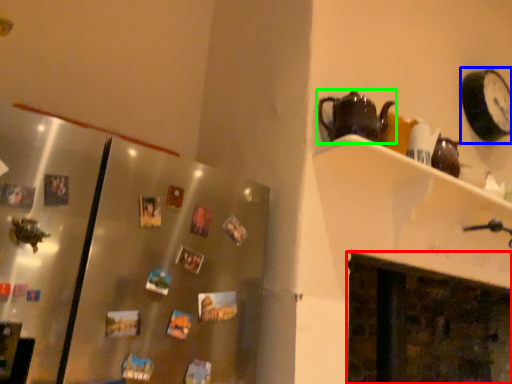
Question: Which object is the closest to the fireplace (highlighted by a red box)? Choose among these: clock (highlighted by a blue box) or kettle (highlighted by a green box).

Choices:
 (A) clock
 (B) kettle

Answer: (A)